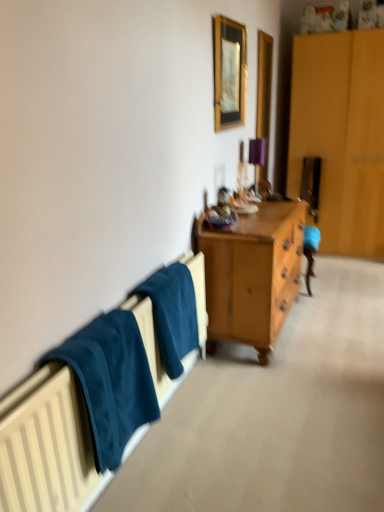
Question: Considering the positions of wooden picture frame at upper center and teal fabric towel at lower left in the image, is wooden picture frame at upper center bigger or smaller than teal fabric towel at lower left?

Choices:
 (A) big
 (B) small

Answer: (B)

Question: Considering the positions of point (230, 36) and point (160, 278), is point (230, 36) closer or farther from the camera than point (160, 278)?

Choices:
 (A) closer
 (B) farther

Answer: (B)

Question: Considering the real-world distances, which object is farthest from the wooden picture frame at upper center?

Choices:
 (A) teal fabric towel at lower left
 (B) dark blue fabric at left

Answer: (B)

Question: Which of these objects is positioned farthest from the teal fabric towel at lower left?

Choices:
 (A) wooden picture frame at upper center
 (B) dark blue fabric at left

Answer: (A)